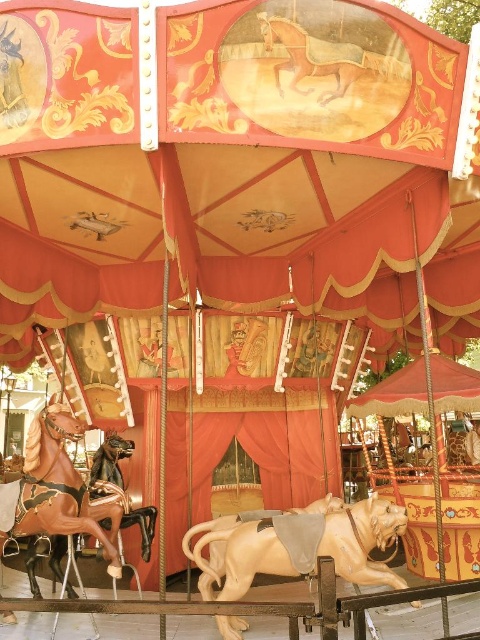
You are a parent with a child who wants to ride both the light brown polished wood horse at center and the shiny brown horse at left. The carousel has a safety rule that children must stay within 3 feet of their parent at all times. Can the parent and child safely ride both horses without violating the safety rule?

The light brown polished wood horse at center and the shiny brown horse at left are 3.89 feet apart from each other. Since the distance between them is more than 3 feet, the parent and child cannot safely ride both horses without violating the safety rule.